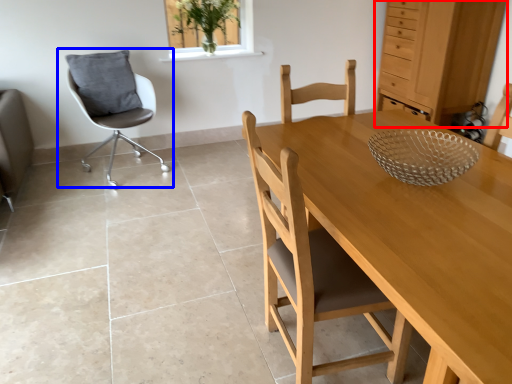
Question: Which of the following is the farthest to the observer, dresser (highlighted by a red box) or chair (highlighted by a blue box)?

Choices:
 (A) dresser
 (B) chair

Answer: (A)